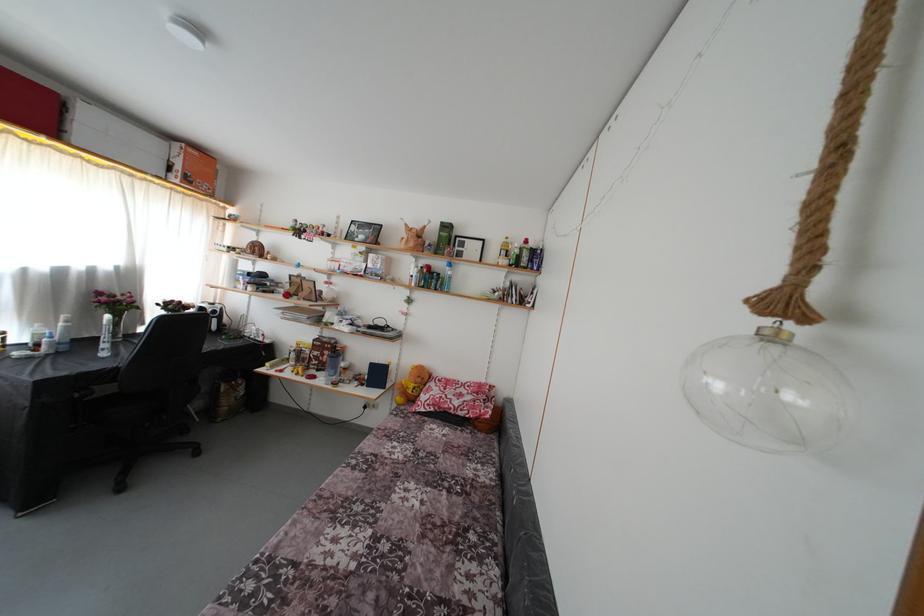
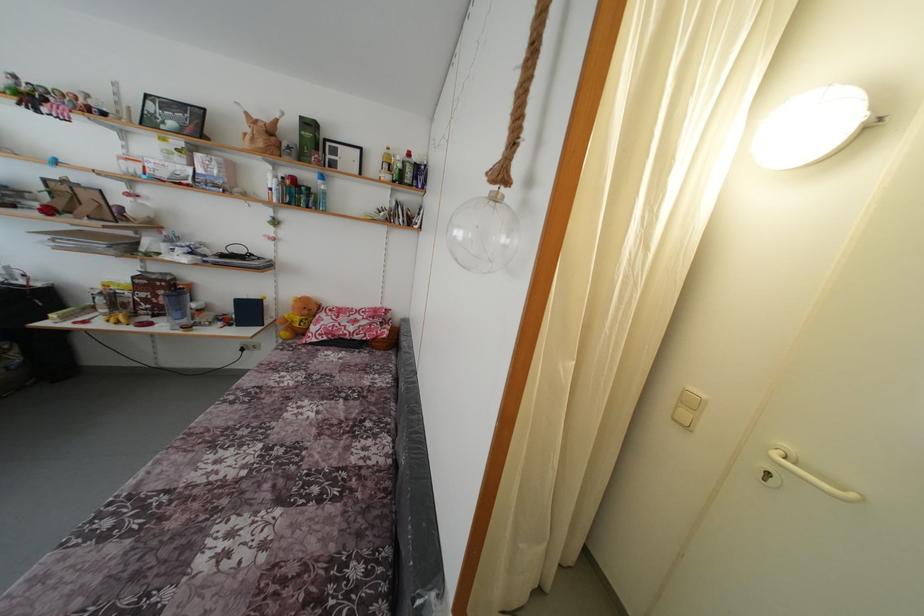
Find the pixel in the second image that matches (x=441, y=392) in the first image.

(332, 321)